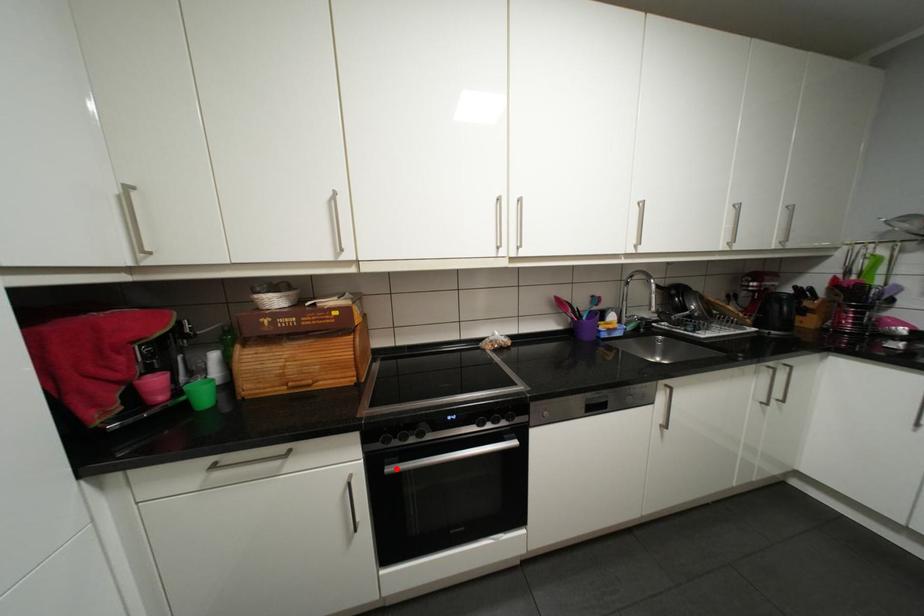
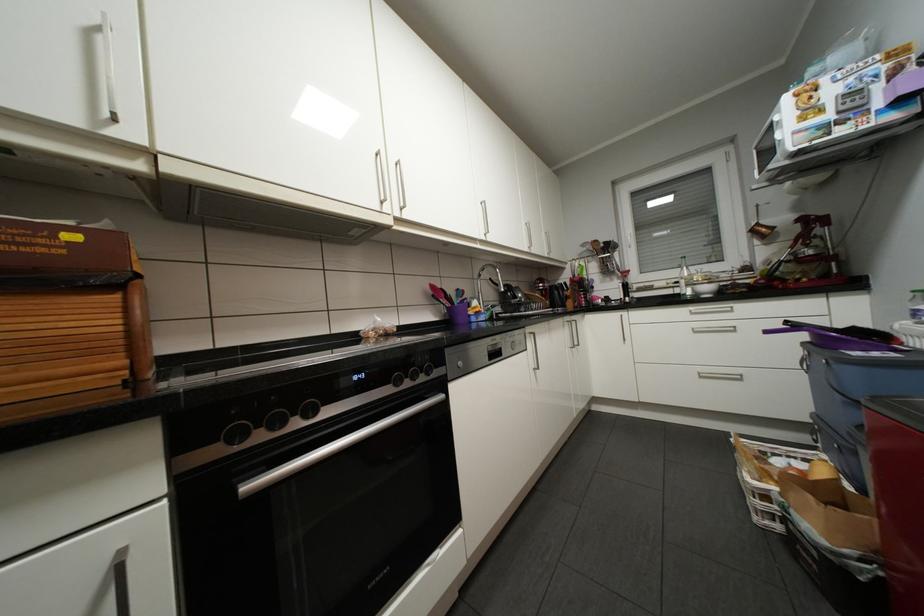
Find the pixel in the second image that matches the highlighted location in the first image.

(254, 485)